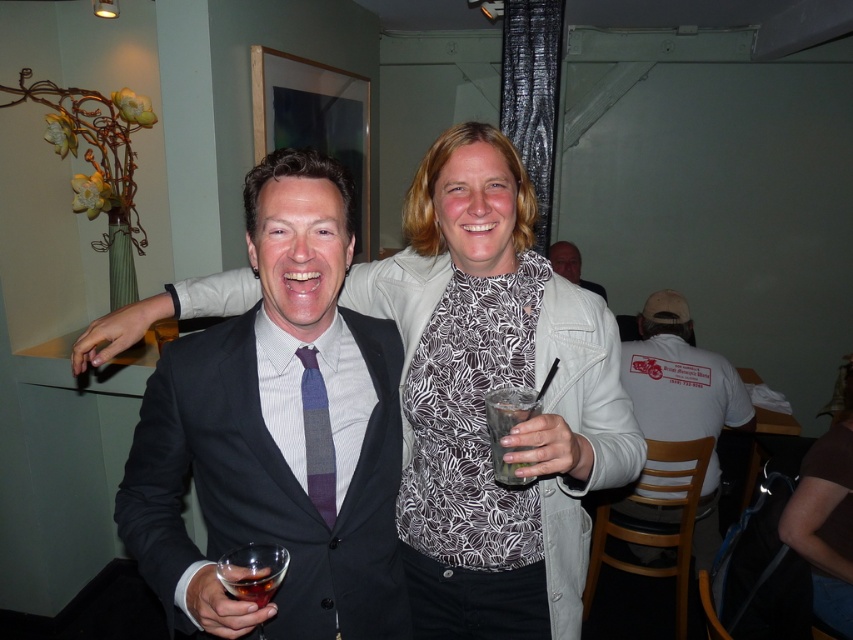
Question: Can you confirm if clear glass drink at center is positioned to the left of translucent glass at lower left?

Choices:
 (A) yes
 (B) no

Answer: (B)

Question: Which object is farther from the camera taking this photo?

Choices:
 (A) matte black suit at center
 (B) white cotton t-shirt at right
 (C) purple striped tie at center
 (D) white matte jacket at upper center

Answer: (D)

Question: From the image, what is the correct spatial relationship of purple striped tie at center in relation to clear glass drink at center?

Choices:
 (A) below
 (B) above

Answer: (A)

Question: From the image, what is the correct spatial relationship of matte black suit at center in relation to translucent glass at lower left?

Choices:
 (A) above
 (B) below

Answer: (A)

Question: Among these points, which one is farthest from the camera?

Choices:
 (A) (701, 392)
 (B) (312, 504)

Answer: (A)

Question: Among these objects, which one is farthest from the camera?

Choices:
 (A) purple striped tie at center
 (B) translucent glass wine at lower left
 (C) white cotton t-shirt at right

Answer: (C)